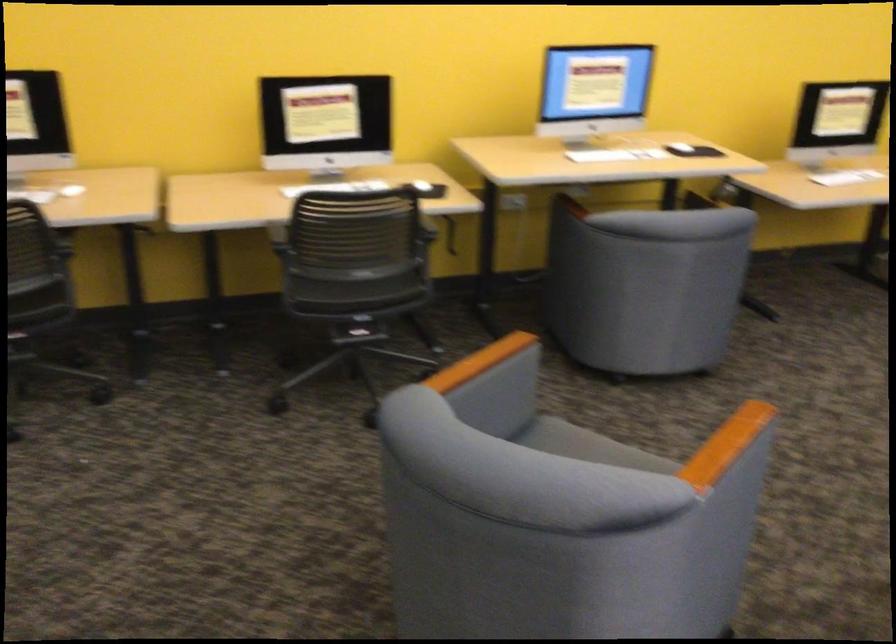
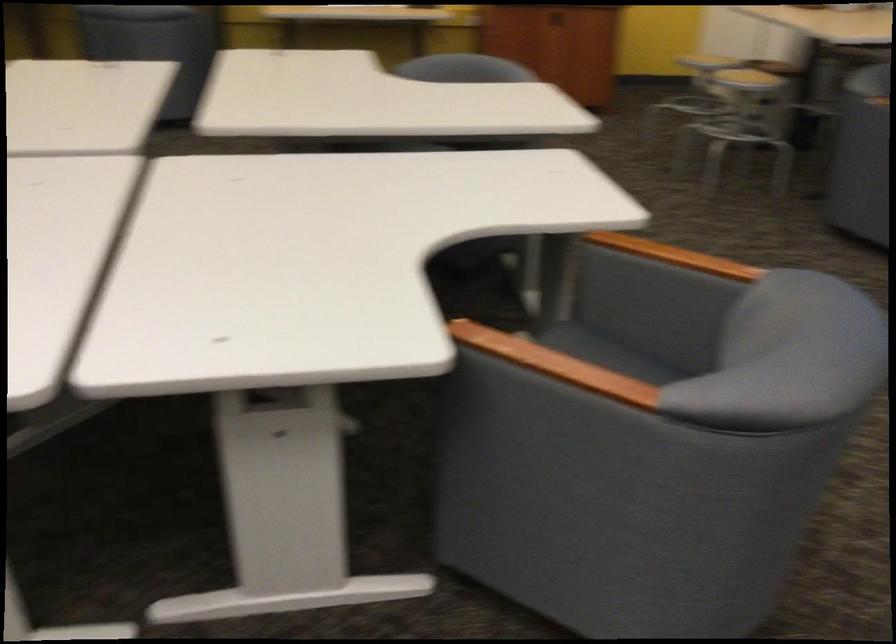
Which direction would the cameraman need to move to produce the second image?

The cameraman moved toward right, backward.